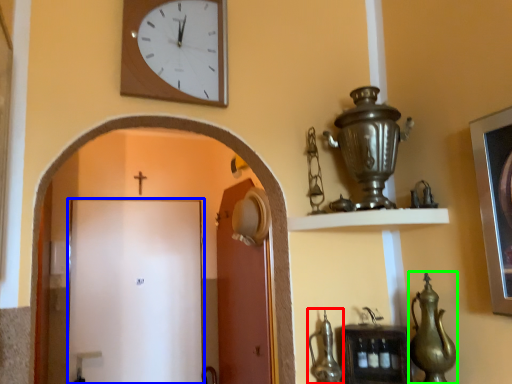
Question: Based on their relative distances, which object is nearer to tea pot (highlighted by a red box)? Choose from door (highlighted by a blue box) and tea pot (highlighted by a green box).

Choices:
 (A) door
 (B) tea pot

Answer: (B)